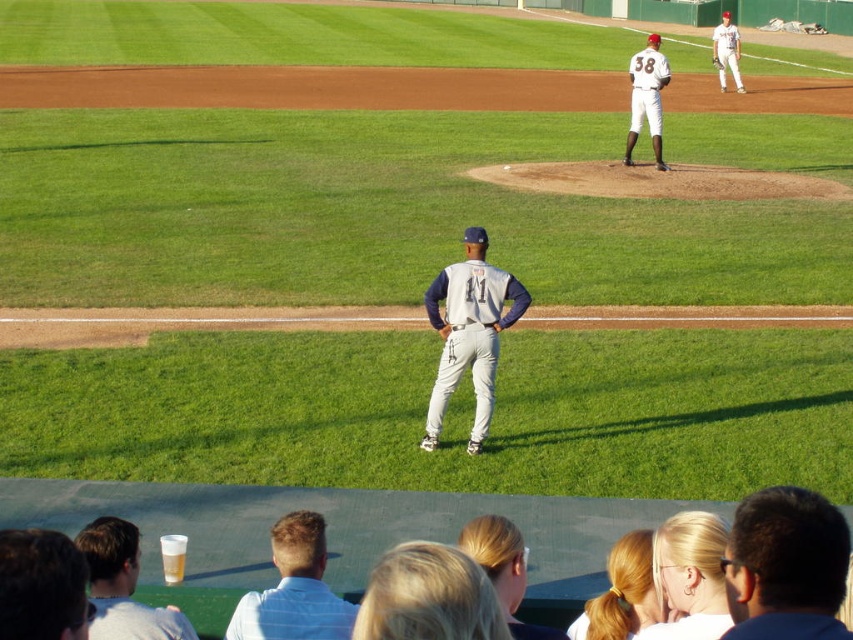
Which is more to the right, gray matte uniform at center or gray fabric baseball uniform at center?

gray fabric baseball uniform at center is more to the right.

Can you confirm if gray matte uniform at center is smaller than gray fabric baseball uniform at center?

No, gray matte uniform at center is not smaller than gray fabric baseball uniform at center.

Is point (231, 497) farther from viewer compared to point (428, 397)?

That is False.

Locate an element on the screen. Image resolution: width=853 pixels, height=640 pixels. gray matte uniform at center is located at coordinates (344, 529).

Is point (125, 600) more distant than point (723, 61)?

No.

Is point (131, 616) less distant than point (718, 61)?

Yes, it is in front of point (718, 61).

Identify the location of translucent plastic cup at lower left. (122, 586).

Looking at this image, is gray fabric baseball uniform at center above white jersey at upper right?

Actually, gray fabric baseball uniform at center is below white jersey at upper right.

Is gray fabric baseball uniform at center behind white jersey at upper right?

That is False.

Measure the distance between gray fabric baseball uniform at center and camera.

A: A distance of 34.89 feet exists between gray fabric baseball uniform at center and camera.

This screenshot has width=853, height=640. What are the coordinates of `gray fabric baseball uniform at center` in the screenshot? It's located at [x=469, y=332].